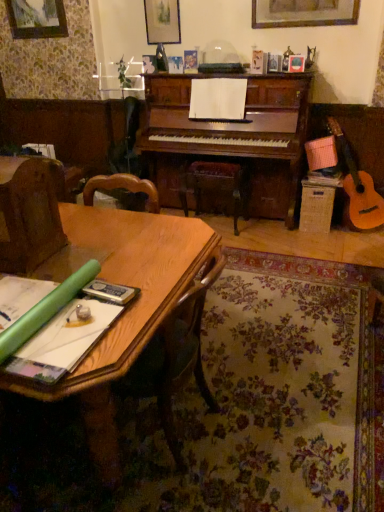
Locate an element on the screen. vacant area to the right of wooden at center is located at coordinates (272, 229).